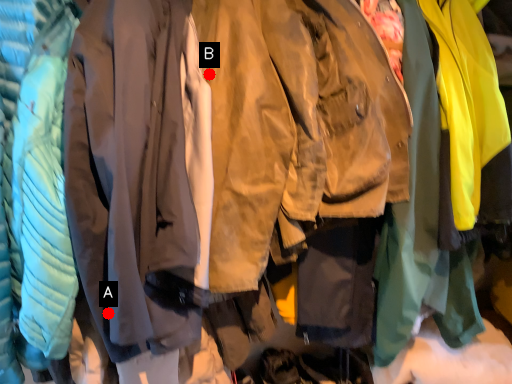
Question: Two points are circled on the image, labeled by A and B beside each circle. Which point is farther to the camera?

Choices:
 (A) A is further
 (B) B is further

Answer: (B)